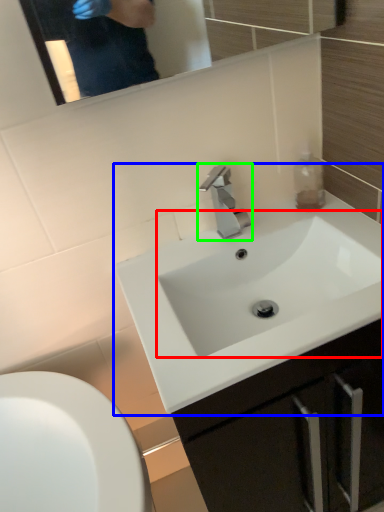
Question: Which object is positioned closest to sink (highlighted by a red box)? Select from sink (highlighted by a blue box) and tap (highlighted by a green box).

Choices:
 (A) sink
 (B) tap

Answer: (A)